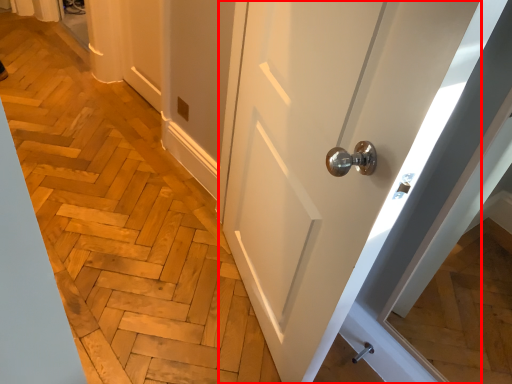
Question: From the image's perspective, what is the correct spatial positioning of door (annotated by the red box) in reference to door handle?

Choices:
 (A) above
 (B) below

Answer: (A)